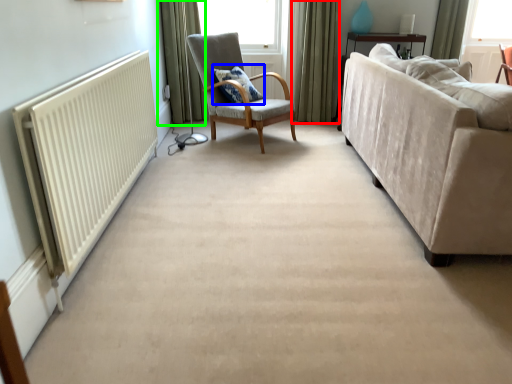
Question: Based on their relative distances, which object is nearer to curtain (highlighted by a red box)? Choose from pillow (highlighted by a blue box) and curtain (highlighted by a green box).

Choices:
 (A) pillow
 (B) curtain

Answer: (A)